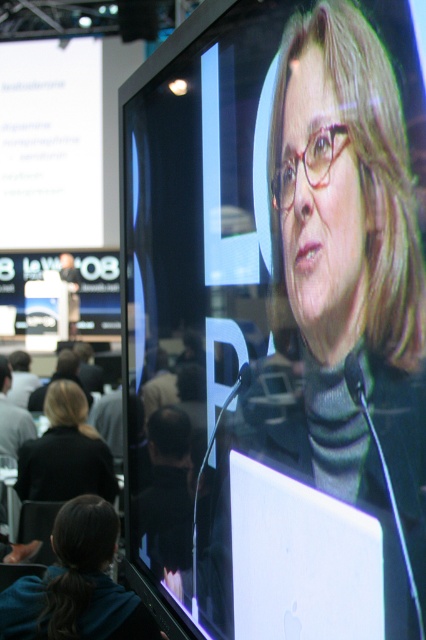
Is white glossy laptop at center smaller than blonde hair at lower left?

Incorrect, white glossy laptop at center is not smaller in size than blonde hair at lower left.

Based on the photo, does white glossy laptop at center appear on the left side of blonde hair at lower left?

Incorrect, white glossy laptop at center is not on the left side of blonde hair at lower left.

Where is `white glossy laptop at center`? This screenshot has width=426, height=640. white glossy laptop at center is located at coordinates (276, 321).

What are the coordinates of `white glossy laptop at center` in the screenshot? It's located at (276, 321).